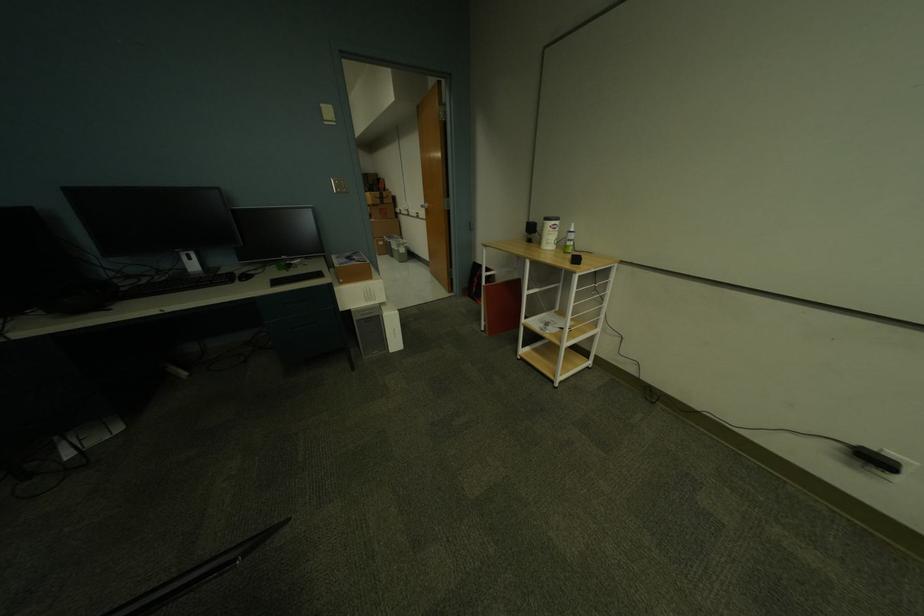
Where is `small cardboard box`? Image resolution: width=924 pixels, height=616 pixels. small cardboard box is located at coordinates (351, 267).